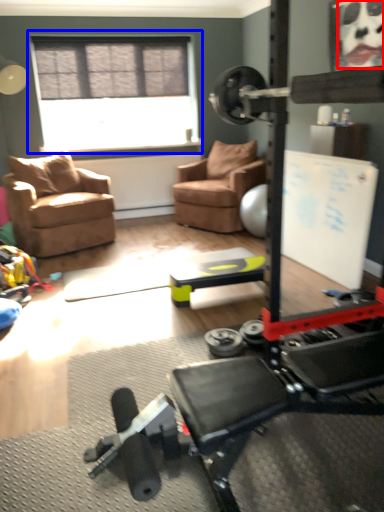
Question: Which object is further to the camera taking this photo, face (highlighted by a red box) or window (highlighted by a blue box)?

Choices:
 (A) face
 (B) window

Answer: (B)